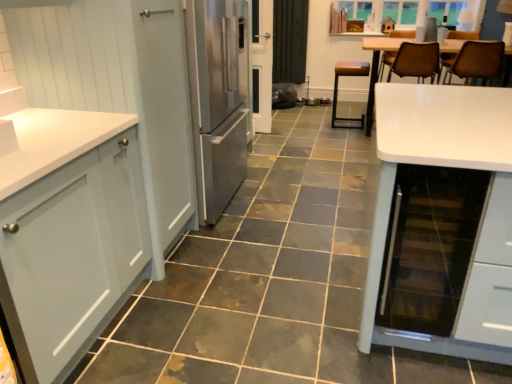
What are the coordinates of `space that is in front of brown leather stool at center, acting as the third chair starting from the right` in the screenshot? It's located at (343, 137).